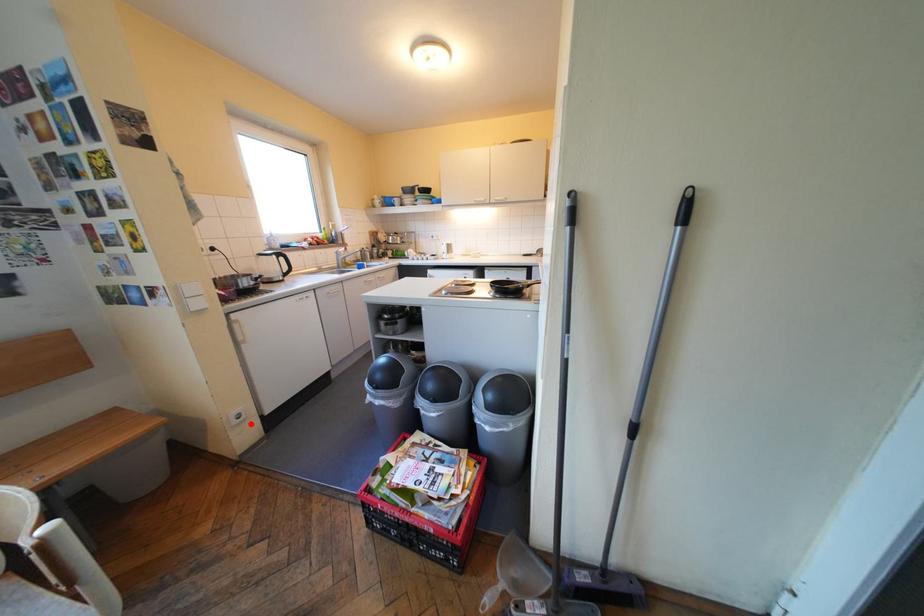
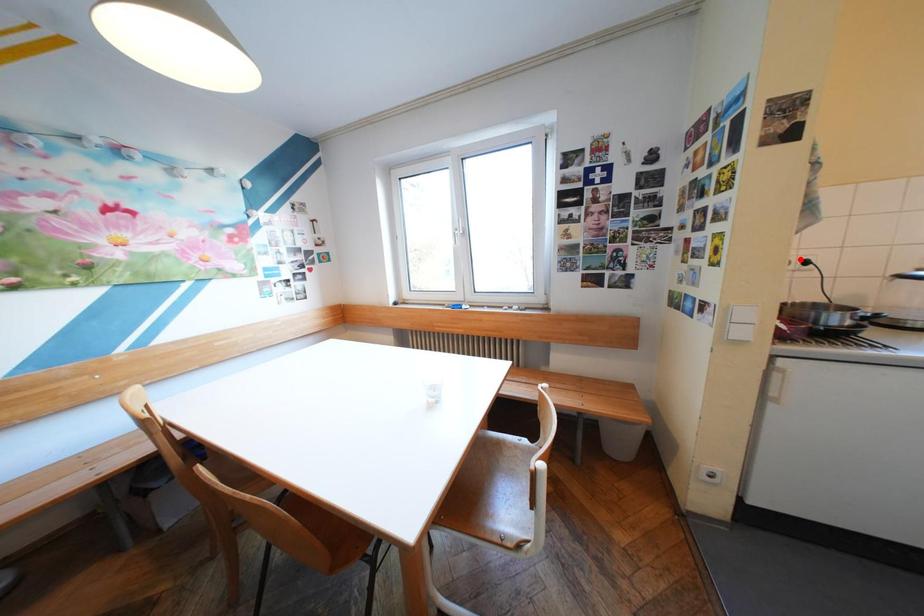
I am providing you with two images of the same scene from different viewpoints. A red point is marked on the first image and another point is marked on the second image. Do the highlighted points in image1 and image2 indicate the same real-world spot?

No